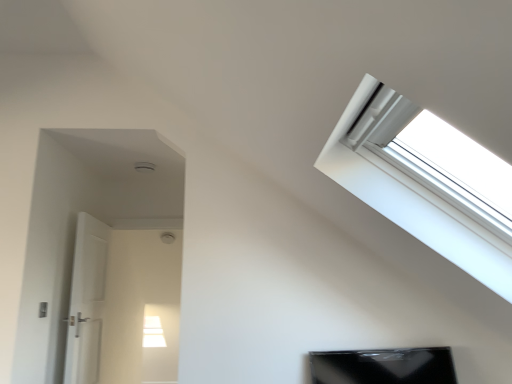
Image resolution: width=512 pixels, height=384 pixels. I want to click on black glossy tv at lower center, so point(383,366).

Describe the element at coordinates (383, 366) in the screenshot. I see `black glossy tv at lower center` at that location.

Where is `black glossy tv at lower center`? Image resolution: width=512 pixels, height=384 pixels. black glossy tv at lower center is located at coordinates (383, 366).